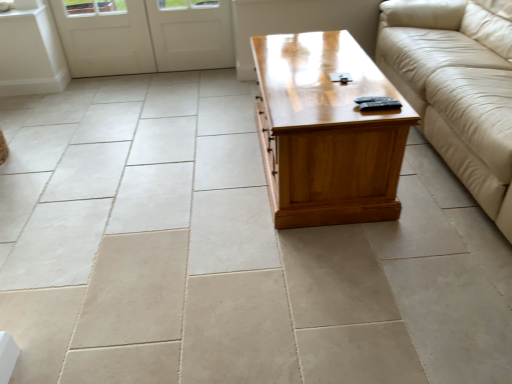
In order to click on vacant space to the left of light brown wood coffee table at center in this screenshot , I will do `click(167, 182)`.